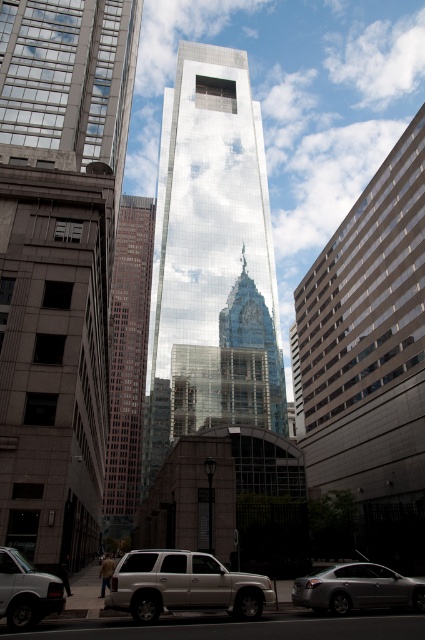
You are a delivery driver approaching the intersection in the image. You need to park your vehicle between the silver metallic sedan at lower right and the matte silver van at lower left. Based on their positions, which side of the road should you choose to park on?

The silver metallic sedan at lower right is located below matte silver van at lower left, so you should park on the right side of the road between them.

You are a delivery driver approaching the city center. You need to park your silver metallic sedan at lower right near the brown brick building at center. Based on the scene, can you determine if the parking spot is directly in front of the building?

The brown brick building at center is to the left of the silver metallic sedan at lower right, so the parking spot is not directly in front of the building but positioned to its left side.

You are a city planner analyzing the urban layout. Given the brown brick building at center and the silver metallic sedan at lower right, which object occupies more space in the image?

The brown brick building at center is bigger than the silver metallic sedan at lower right, so it occupies more space in the image.